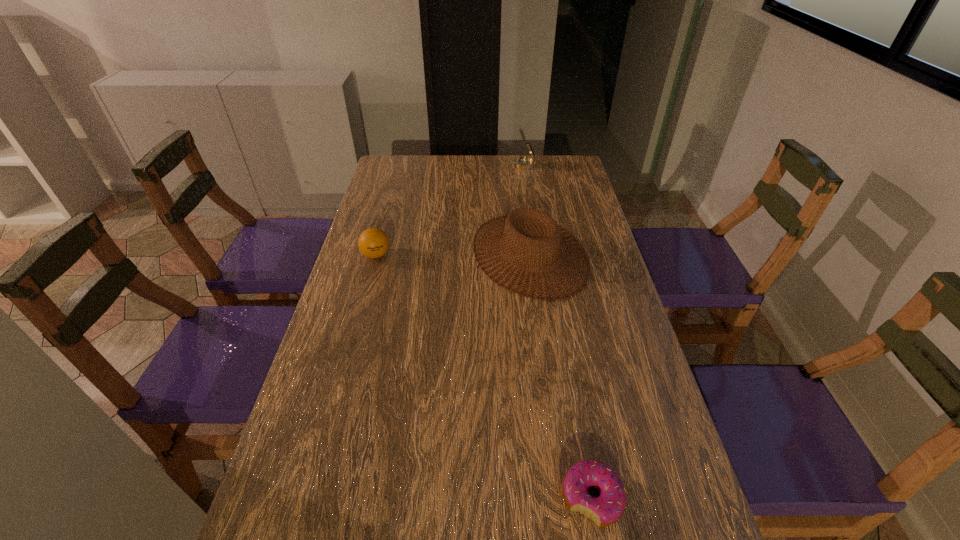
Identify the location of free spot located on the back of the shortest object. (563, 336).

This screenshot has width=960, height=540. Find the location of `object positioned at the far edge`. object positioned at the far edge is located at coordinates (525, 163).

Where is `object situated at the left edge`? The image size is (960, 540). object situated at the left edge is located at coordinates (373, 242).

I want to click on sunhat that is at the right edge, so click(x=528, y=222).

Where is `doughnut situated at the right edge`? The height and width of the screenshot is (540, 960). doughnut situated at the right edge is located at coordinates (606, 509).

Where is `vacant region at the far edge`? vacant region at the far edge is located at coordinates (462, 161).

Identify the location of vacant space at the left edge of the desktop. (384, 201).

The image size is (960, 540). What are the coordinates of `vacant space at the right edge of the desktop` in the screenshot? It's located at tap(595, 292).

Where is `vacant space at the far left corner`? vacant space at the far left corner is located at coordinates (391, 170).

Find the location of `free space between the sunhat and the leftmost object`. free space between the sunhat and the leftmost object is located at coordinates (453, 254).